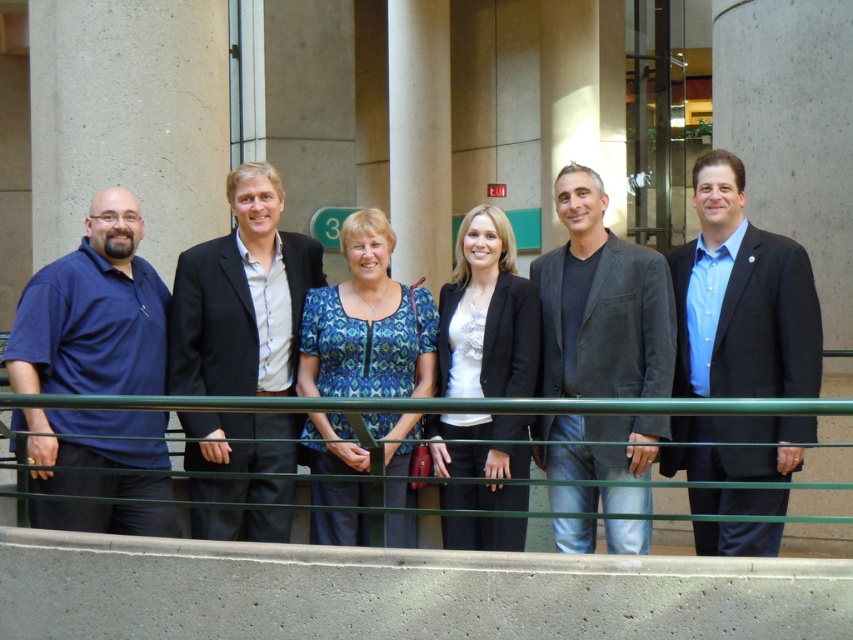
You are a photographer trying to capture a clear shot of the matte blue polo shirt at left and the green glass rail at center. Based on their heights, which object should you focus on first to ensure both are in frame?

The matte blue polo shirt at left is taller than the green glass rail at center, so you should focus on the matte blue polo shirt at left first to ensure both are in frame.

You are standing in front of the modern architectural structure and see the blue shirt at center and the green glass rail at center. Which object is positioned to the right side from your perspective?

The blue shirt at center is positioned to the right of the green glass rail at center.

You are standing in front of the modern building and see a group of people behind the green metal railing. There is a point at coordinate (93,312). What object is located at that point?

The point at coordinate (93,312) has the matte blue polo shirt at left.